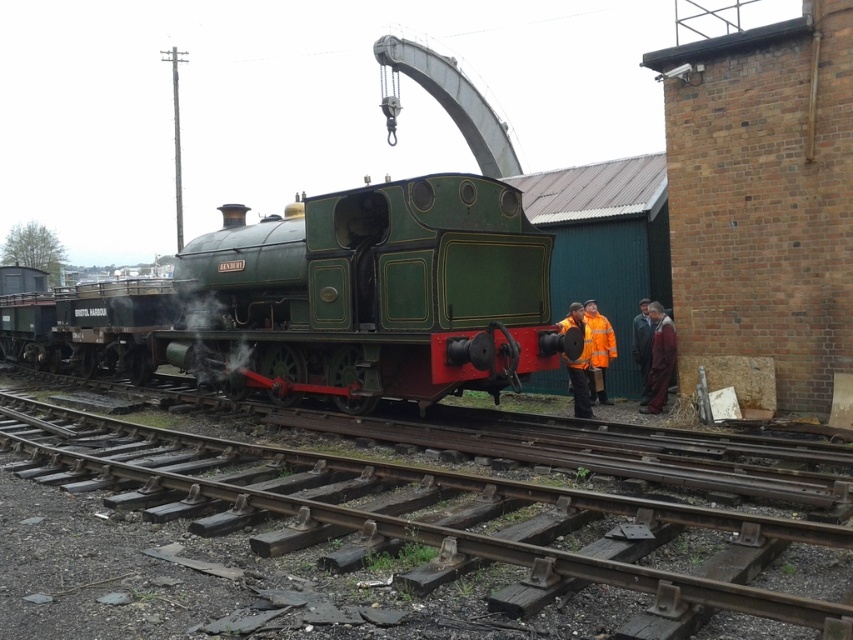
You are a photographer standing at the railway yard. You want to take a photo of the green polished wood train at center and the orange jacket at center. Which object should you focus on first if you want to capture both in a single frame without moving the camera?

The green polished wood train at center is taller than the orange jacket at center, so you should focus on the green polished wood train at center first to ensure it fits within the frame.